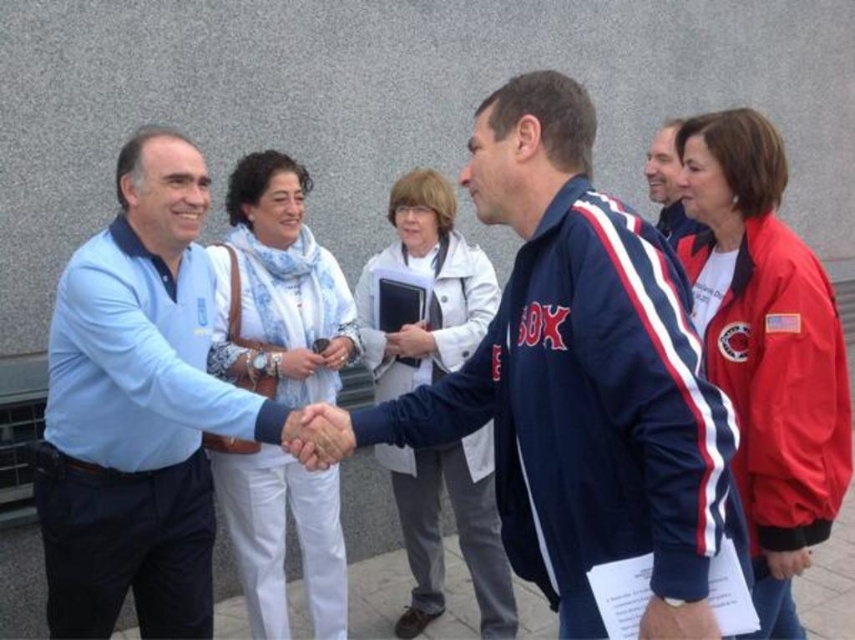
Question: Among these objects, which one is farthest from the camera?

Choices:
 (A) white cotton scarf at center
 (B) white matte hand at center

Answer: (B)

Question: Which point appears closest to the camera in this image?

Choices:
 (A) (280, 236)
 (B) (647, 192)

Answer: (A)

Question: Is blue fabric jacket at upper center positioned at the back of white matte hand at center?

Choices:
 (A) yes
 (B) no

Answer: (B)

Question: Which object is positioned farthest from the blue fabric jacket at upper center?

Choices:
 (A) navy blue track jacket at center
 (B) red jacket at right
 (C) smooth skin handshake at center
 (D) white matte hand at center

Answer: (C)

Question: Can you confirm if white fabric coat at center is positioned below matte black phone at center?

Choices:
 (A) no
 (B) yes

Answer: (B)

Question: From the image, what is the correct spatial relationship of navy blue track jacket at center in relation to white fabric coat at center?

Choices:
 (A) left
 (B) right

Answer: (B)